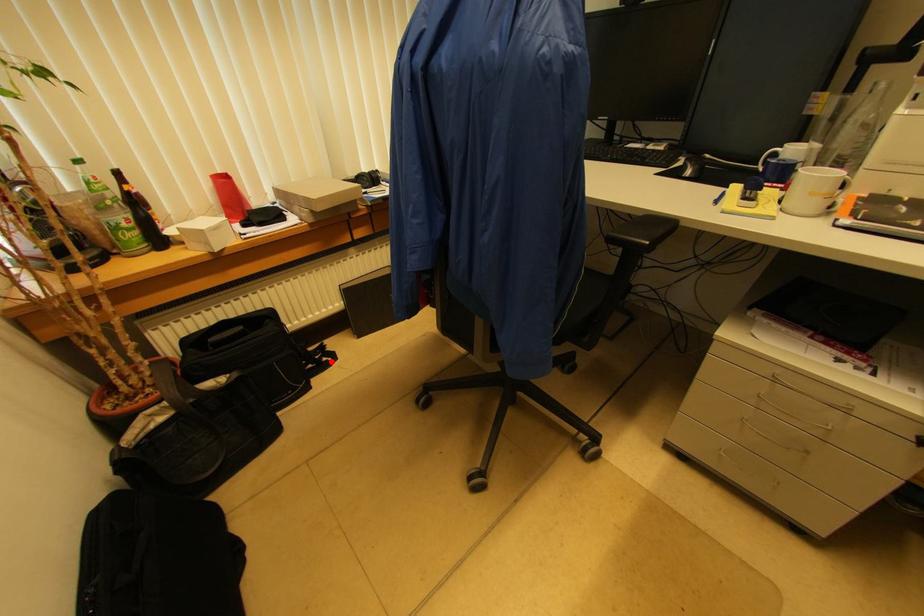
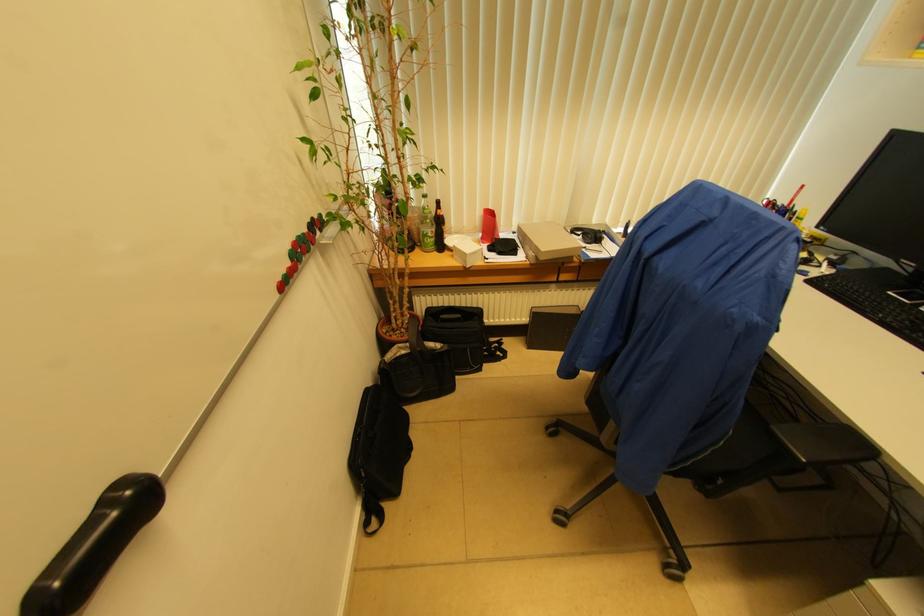
Question: I am providing you with two images of the same scene from different viewpoints. In image1, a red point is highlighted. Considering the same 3D point in image2, which of the following is correct?

Choices:
 (A) It is closer
 (B) It is farther

Answer: (B)